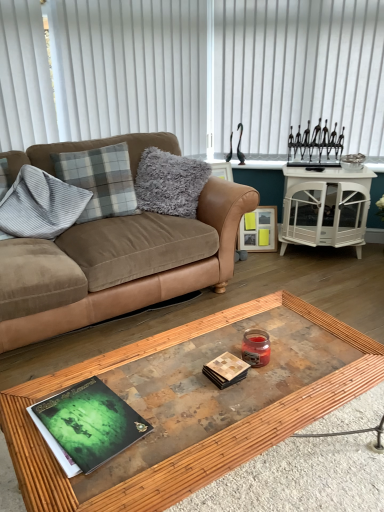
Locate an element on the screen. unoccupied area in front of green matte magazine at center, marked as the first magazine in a right-to-left arrangement is located at coordinates (234, 414).